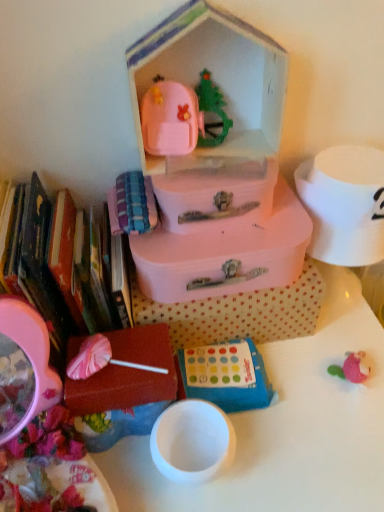
The height and width of the screenshot is (512, 384). Find the location of `spots to the right of pink matte lollipop at lower left, the 1th storage box ordered from the bottom`. spots to the right of pink matte lollipop at lower left, the 1th storage box ordered from the bottom is located at coordinates (279, 423).